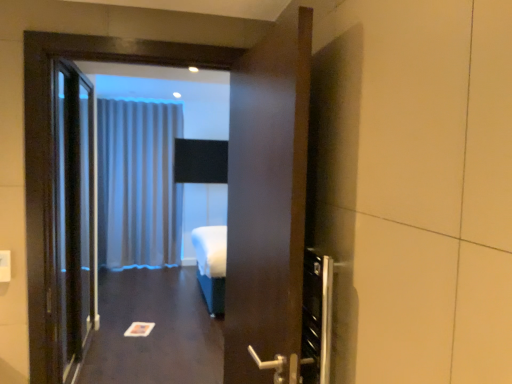
Question: From a real-world perspective, is white glossy paper at center over black glass elevator door at left?

Choices:
 (A) no
 (B) yes

Answer: (A)

Question: Is white glossy paper at center wider than black glass elevator door at left?

Choices:
 (A) no
 (B) yes

Answer: (B)

Question: From the image's perspective, does white glossy paper at center appear lower than black glass elevator door at left?

Choices:
 (A) yes
 (B) no

Answer: (A)

Question: Considering the relative sizes of white glossy paper at center and black glass elevator door at left in the image provided, is white glossy paper at center shorter than black glass elevator door at left?

Choices:
 (A) yes
 (B) no

Answer: (A)

Question: Considering the relative sizes of white glossy paper at center and black glass elevator door at left in the image provided, is white glossy paper at center taller than black glass elevator door at left?

Choices:
 (A) yes
 (B) no

Answer: (B)

Question: Is white glossy paper at center directly adjacent to black glass elevator door at left?

Choices:
 (A) no
 (B) yes

Answer: (A)

Question: From the image's perspective, is satin fabric curtain at center located beneath white glossy paper at center?

Choices:
 (A) no
 (B) yes

Answer: (A)

Question: Considering the relative sizes of satin fabric curtain at center and white glossy paper at center in the image provided, is satin fabric curtain at center taller than white glossy paper at center?

Choices:
 (A) yes
 (B) no

Answer: (A)

Question: Considering the relative positions of satin fabric curtain at center and white glossy paper at center in the image provided, is satin fabric curtain at center to the left of white glossy paper at center from the viewer's perspective?

Choices:
 (A) yes
 (B) no

Answer: (A)

Question: Is satin fabric curtain at center looking in the opposite direction of white glossy paper at center?

Choices:
 (A) yes
 (B) no

Answer: (B)

Question: From a real-world perspective, is satin fabric curtain at center located higher than white glossy paper at center?

Choices:
 (A) yes
 (B) no

Answer: (A)

Question: Is the position of satin fabric curtain at center more distant than that of white glossy paper at center?

Choices:
 (A) no
 (B) yes

Answer: (B)

Question: From a real-world perspective, is satin fabric curtain at center under black glass elevator door at left?

Choices:
 (A) no
 (B) yes

Answer: (A)